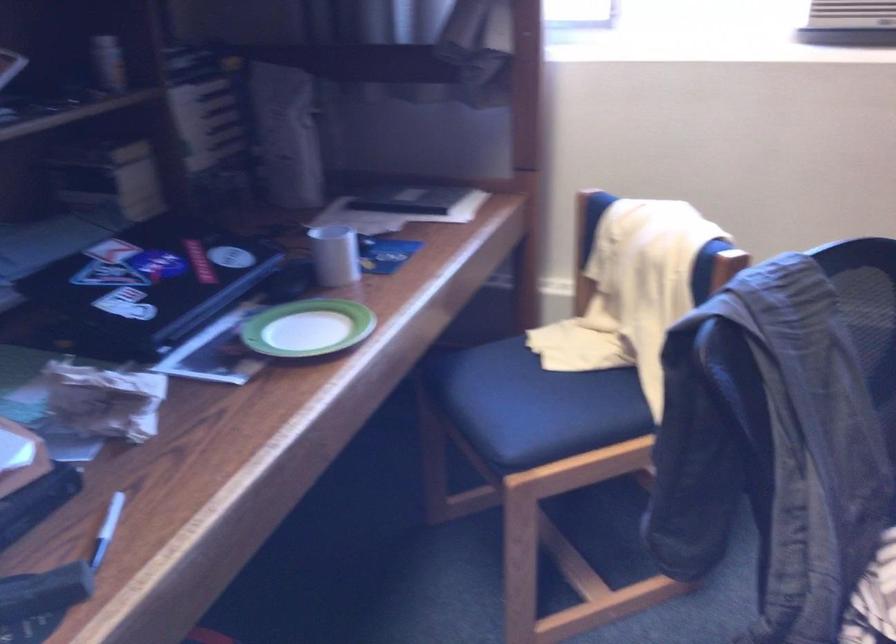
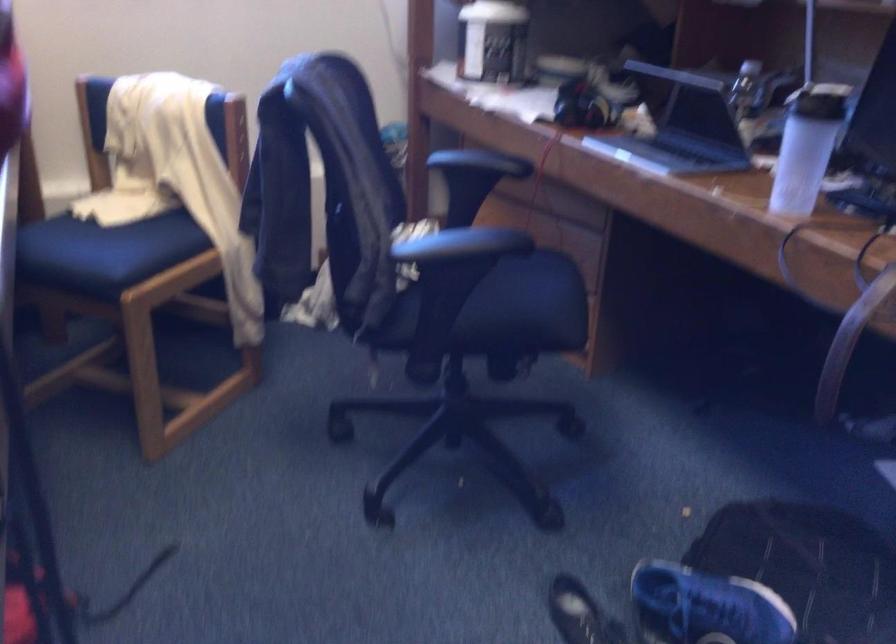
Where in the second image is the point corresponding to point (580, 335) from the first image?

(123, 200)